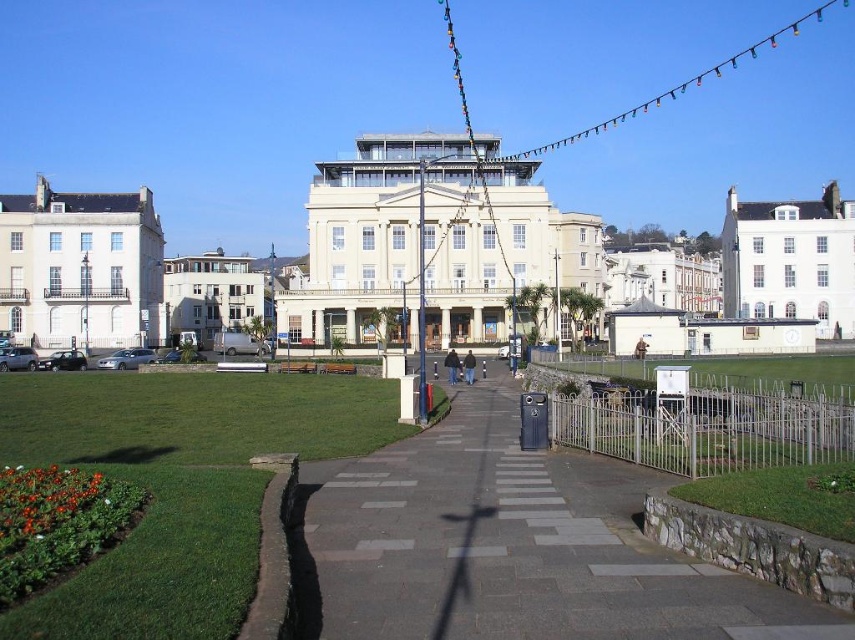
Is white painted wood palace at upper right bigger than white glossy building at center-left?

Actually, white painted wood palace at upper right might be smaller than white glossy building at center-left.

What do you see at coordinates (789, 260) in the screenshot?
I see `white painted wood palace at upper right` at bounding box center [789, 260].

Locate an element on the screen. white painted wood palace at upper right is located at coordinates (789, 260).

Can you confirm if silver metallic fence at center-right is smaller than white painted wood palace at upper right?

Correct, silver metallic fence at center-right occupies less space than white painted wood palace at upper right.

Is silver metallic fence at center-right below white painted wood palace at upper right?

Yes, silver metallic fence at center-right is below white painted wood palace at upper right.

Between point (758, 400) and point (734, 314), which one is positioned behind?

Point (734, 314)

Locate an element on the screen. silver metallic fence at center-right is located at coordinates (703, 428).

Does green grass at lower left have a lesser width compared to white glossy building at center-left?

No, green grass at lower left is not thinner than white glossy building at center-left.

The width and height of the screenshot is (855, 640). What do you see at coordinates (177, 484) in the screenshot? I see `green grass at lower left` at bounding box center [177, 484].

The width and height of the screenshot is (855, 640). Identify the location of green grass at lower left. (177, 484).